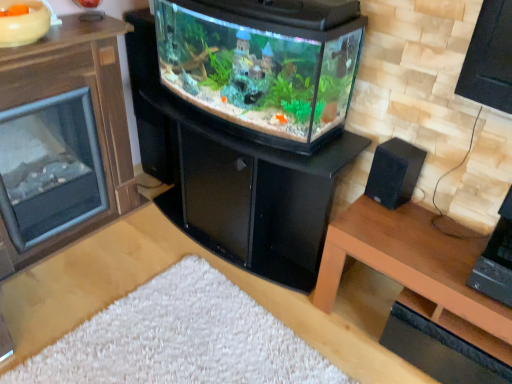
Find the location of a particular element. vacant space situated on the left part of brown wood table at lower right is located at coordinates (279, 337).